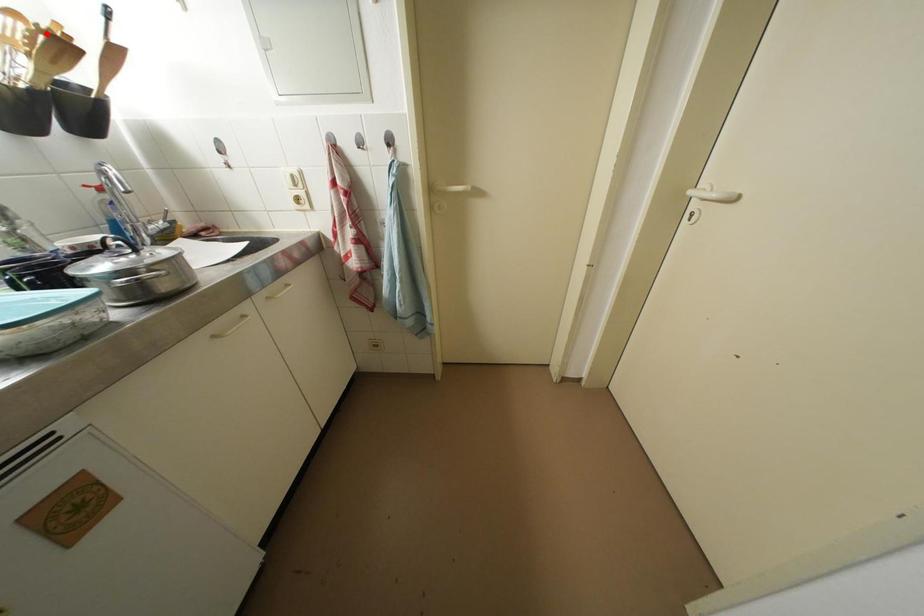
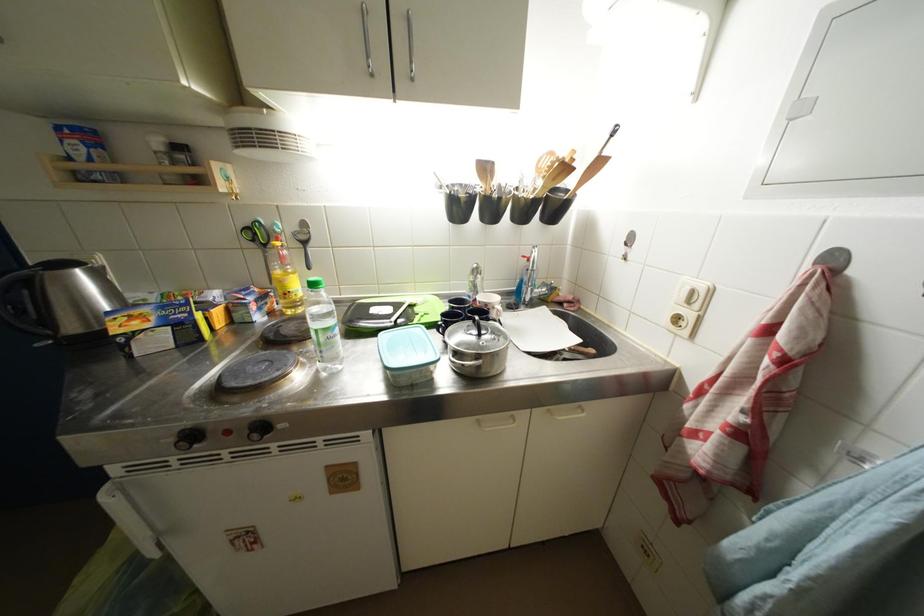
Question: I am providing you with two images of the same scene from different viewpoints. Image1 has a red point marked. In image2, the corresponding 3D location appears at what relative position? Reply with the corresponding letter.

Choices:
 (A) Closer
 (B) Farther

Answer: (A)